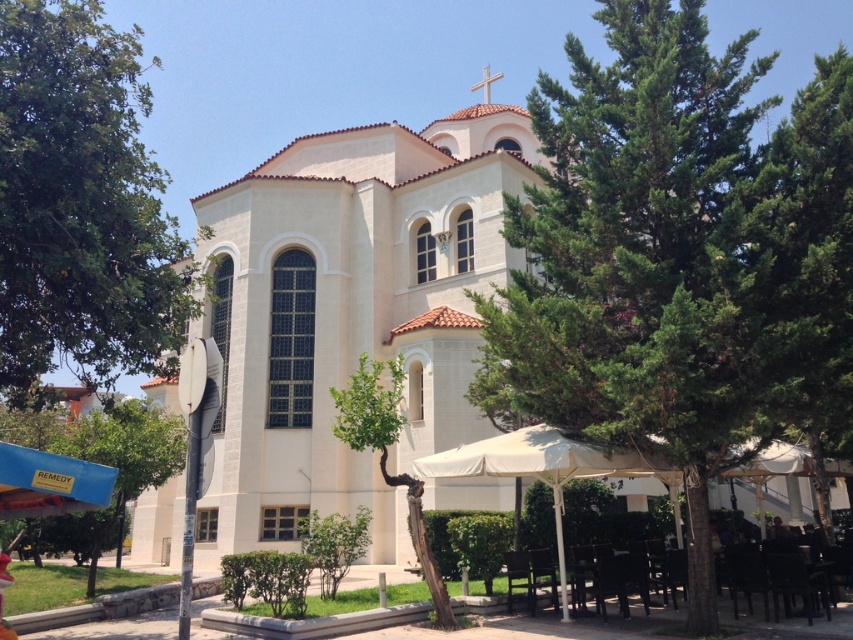
Question: Among these points, which one is nearest to the camera?

Choices:
 (A) (515, 586)
 (B) (326, 525)
 (C) (143, 84)
 (D) (335, 378)

Answer: (A)

Question: Considering the relative positions of green leafy tree at lower left and white fabric umbrella at lower center in the image provided, where is green leafy tree at lower left located with respect to white fabric umbrella at lower center?

Choices:
 (A) left
 (B) right

Answer: (A)

Question: In this image, where is green leafy tree at center located relative to green leafy tree at left?

Choices:
 (A) right
 (B) left

Answer: (A)

Question: Can you confirm if green leafy tree at center is positioned to the left of white fabric umbrella at lower center?

Choices:
 (A) no
 (B) yes

Answer: (A)

Question: Which point is farther to the camera?

Choices:
 (A) (352, 442)
 (B) (117, 458)
 (C) (103, 472)

Answer: (B)

Question: Which object appears closest to the camera in this image?

Choices:
 (A) white fabric umbrella at lower center
 (B) green leafy tree at left

Answer: (A)